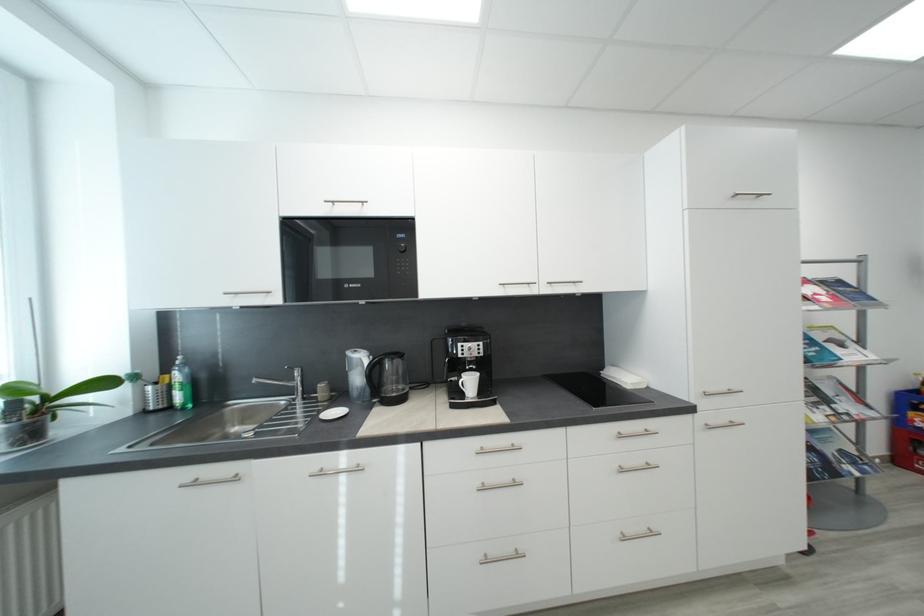
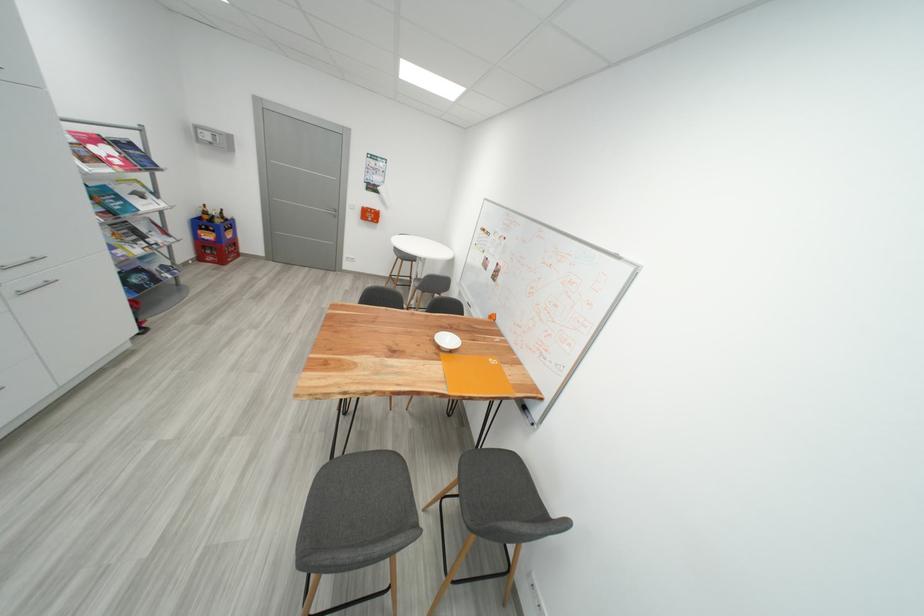
In the second image, find the point that corresponds to the point at 718,424 in the first image.

(30, 291)